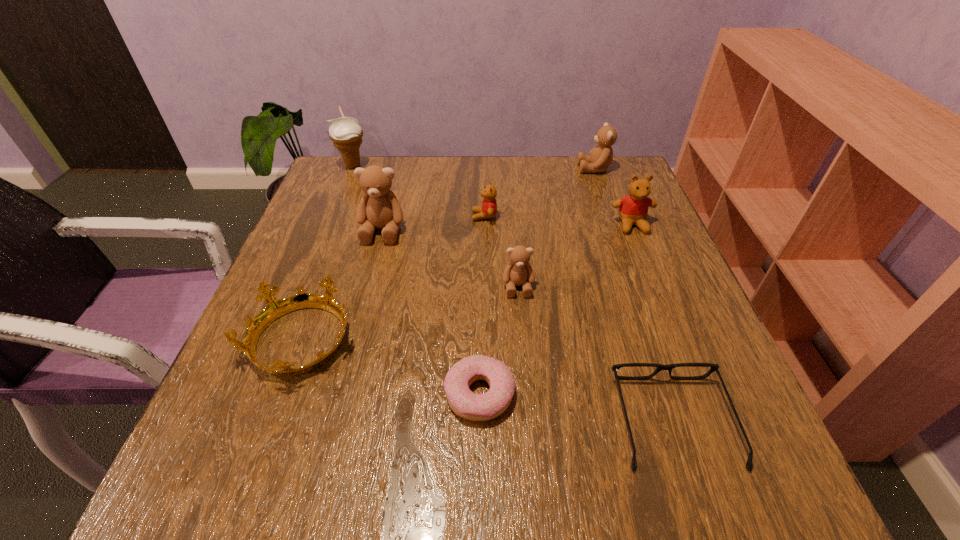
Where is `blank space located on the front-facing side of the second teddy bear from left to right`? The height and width of the screenshot is (540, 960). blank space located on the front-facing side of the second teddy bear from left to right is located at coordinates (374, 216).

Where is `free space located on the front-facing side of the second teddy bear from left to right`? This screenshot has height=540, width=960. free space located on the front-facing side of the second teddy bear from left to right is located at coordinates (408, 216).

Where is `vacant space situated 0.350m on the front-facing side of the second teddy bear from left to right`? vacant space situated 0.350m on the front-facing side of the second teddy bear from left to right is located at coordinates (324, 216).

At what (x,y) coordinates should I click in order to perform the action: click on vacant space located on the front-facing side of the nearest teddy bear. Please return your answer as a coordinate pair (x, y). This screenshot has height=540, width=960. Looking at the image, I should click on (534, 465).

This screenshot has width=960, height=540. I want to click on blank area located on the back of the gold crown, so click(325, 276).

I want to click on blank space located on the front-facing side of the spectacles, so click(627, 283).

The height and width of the screenshot is (540, 960). Find the location of `vacant position located on the front-facing side of the spectacles`. vacant position located on the front-facing side of the spectacles is located at coordinates (650, 353).

Find the location of a particular element. This screenshot has height=540, width=960. vacant space located 0.310m on the front-facing side of the spectacles is located at coordinates (616, 253).

I want to click on free location located 0.070m on the right of the doughnut, so tap(558, 394).

Where is `icecream located in the far edge section of the desktop`? This screenshot has width=960, height=540. icecream located in the far edge section of the desktop is located at coordinates (346, 133).